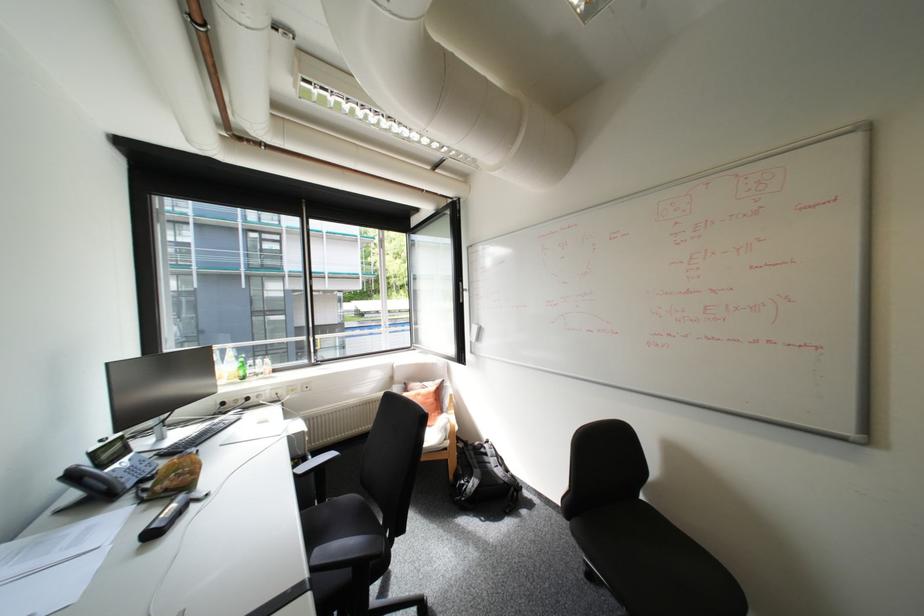
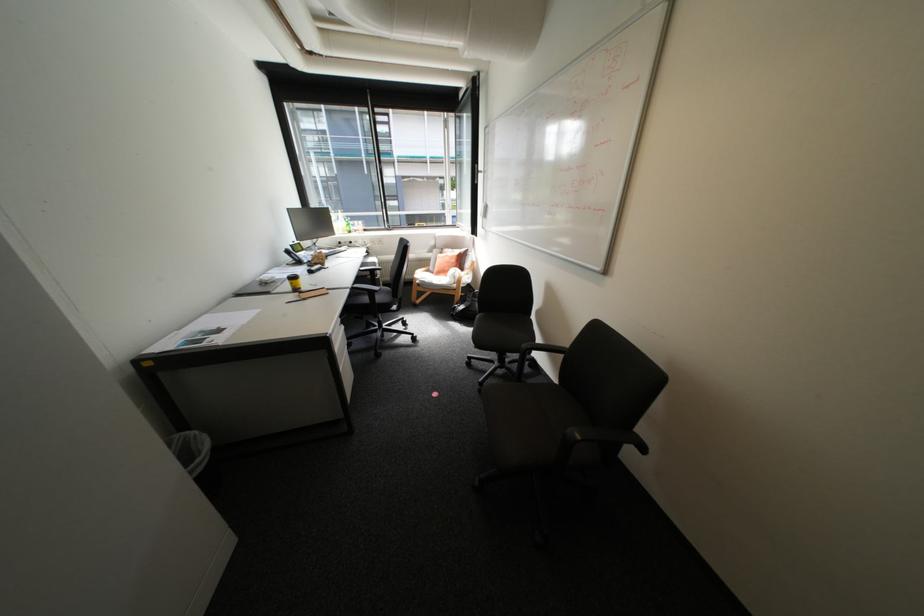
Locate, in the second image, the point that corresponds to [315,573] in the first image.

(359, 286)